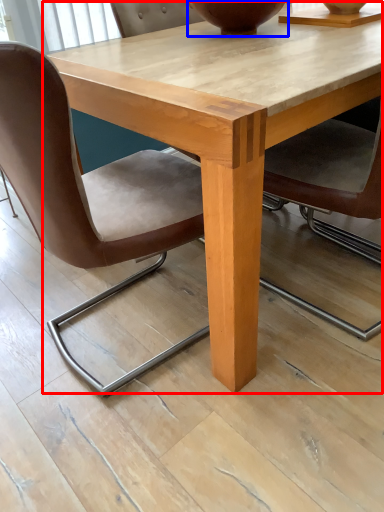
Question: Among these objects, which one is farthest to the camera, coffee table (highlighted by a red box) or vase (highlighted by a blue box)?

Choices:
 (A) coffee table
 (B) vase

Answer: (B)